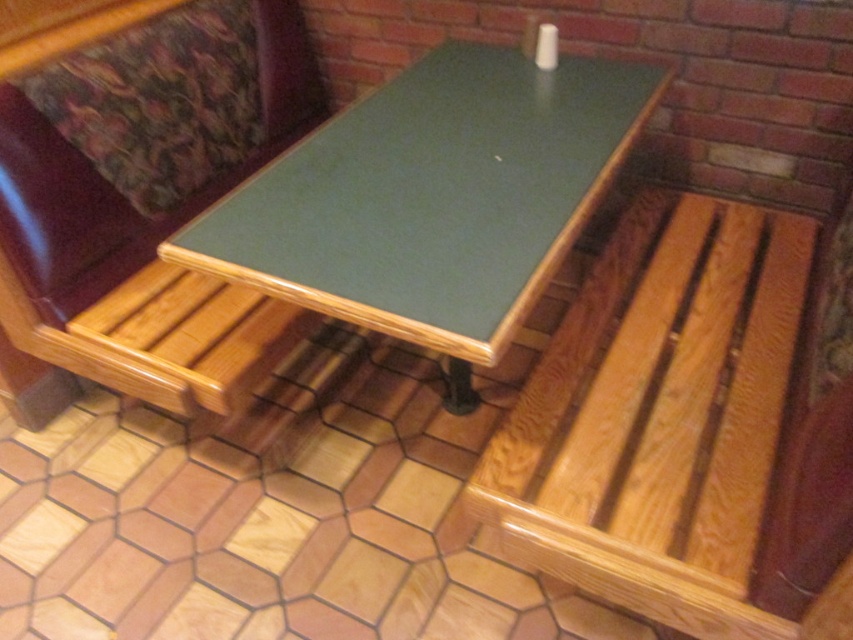
You are standing in the room and want to move from the wooden bench at center to the light brown wood bench at lower right. Which direction should you move in?

You should move to the right to reach the light brown wood bench at lower right from the wooden bench at center because the light brown wood bench at lower right is located to the right of the wooden bench at center.

You are planning to place a rectangular box that measures 1.2 meters in length on the floor. Given the green laminate table at center and the wooden bench at center, which object would you need to move to make space?

The green laminate table at center is bigger than the wooden bench at center, so you would need to move the green laminate table at center to make space for the box.

You are a customer in a small cafe and want to sit down. You see the light brown wood bench at lower right and the green laminate table at center. Which object is located beneath the other?

The light brown wood bench at lower right is positioned under the green laminate table at center.